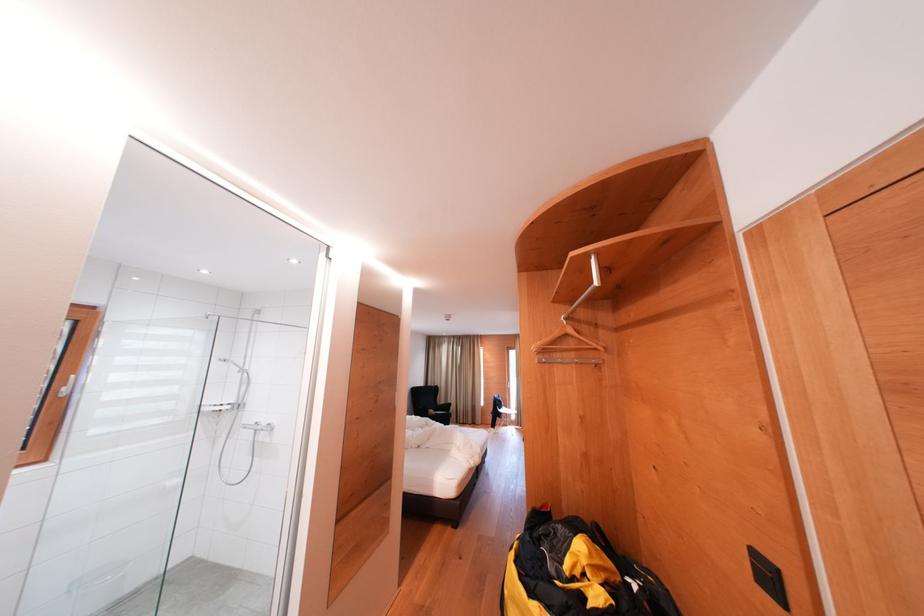
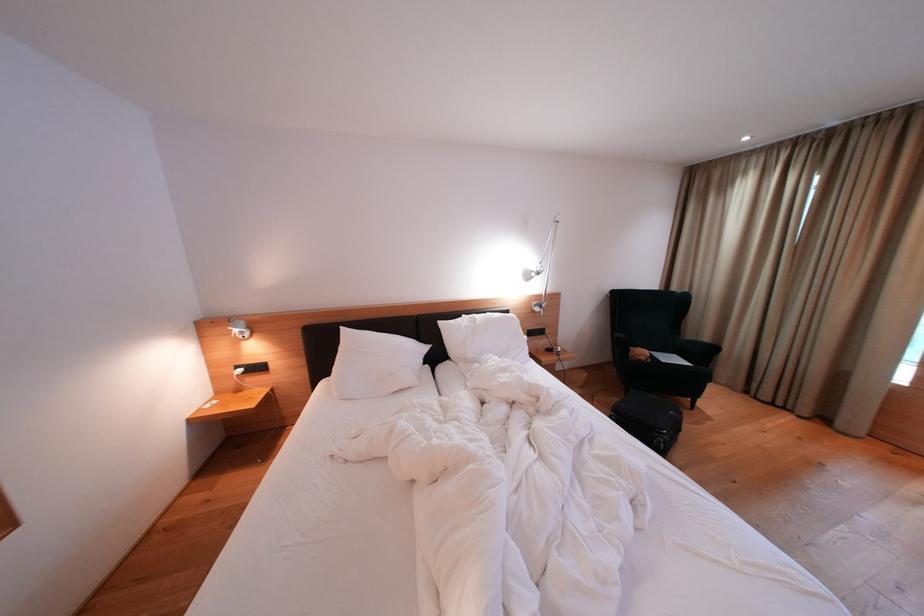
Locate, in the second image, the point that corresponds to (x=455, y=411) in the first image.

(710, 358)